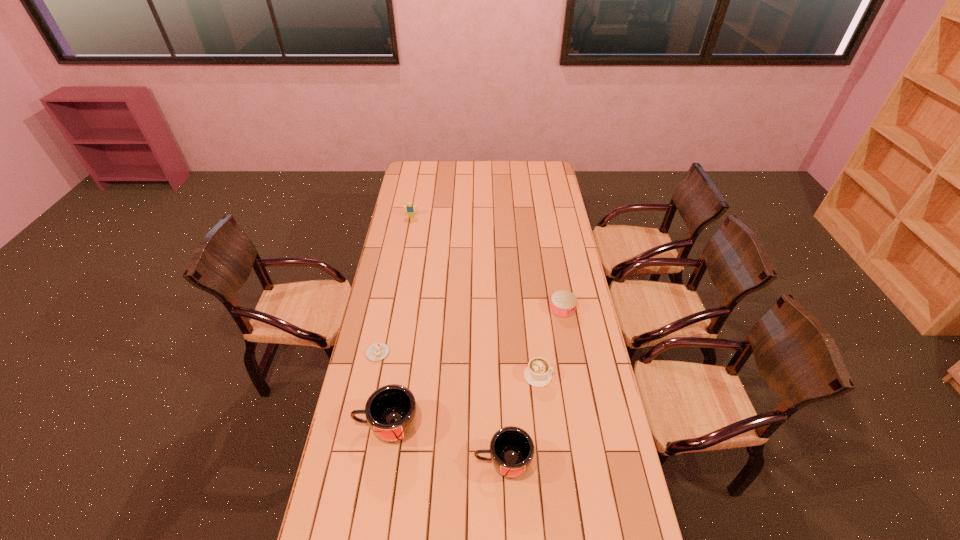
The width and height of the screenshot is (960, 540). I want to click on cupcake situated at the left edge, so click(x=377, y=351).

The height and width of the screenshot is (540, 960). What are the coordinates of `object that is at the right edge` in the screenshot? It's located at (563, 303).

This screenshot has width=960, height=540. Find the location of `vacant point at the far edge`. vacant point at the far edge is located at coordinates (491, 173).

I want to click on blank area at the left edge, so click(403, 224).

The image size is (960, 540). Find the location of `vacant position at the right edge of the desktop`. vacant position at the right edge of the desktop is located at coordinates (590, 355).

What are the coordinates of `blank space at the near right corner of the desktop` in the screenshot? It's located at (592, 525).

Where is `free space that is in between the Lego and the third nearest object`? free space that is in between the Lego and the third nearest object is located at coordinates (475, 296).

Identify the location of unoccupied area between the second farthest object and the third nearest object. (550, 342).

Locate an element on the screen. This screenshot has height=540, width=960. empty location between the taller mug and the rightmost object is located at coordinates (475, 367).

Where is `empty space between the shorter mug and the fourth shortest object`? This screenshot has width=960, height=540. empty space between the shorter mug and the fourth shortest object is located at coordinates (457, 340).